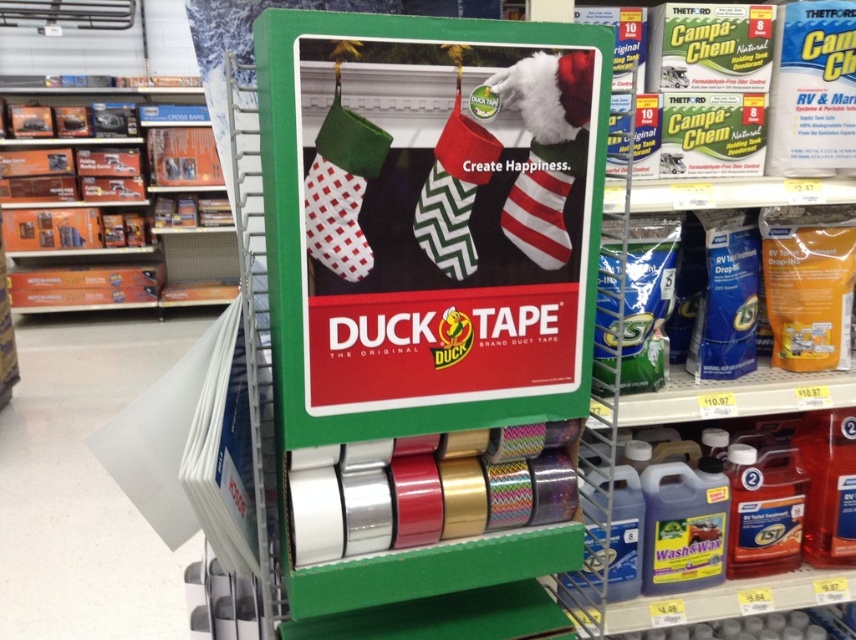
Who is positioned more to the left, translucent plastic bottle at lower right or red and white striped sock at center?

red and white striped sock at center

Which of these two, translucent plastic bottle at lower right or red and white striped sock at center, stands taller?

translucent plastic bottle at lower right

Find the location of `translucent plastic bottle at lower right`. translucent plastic bottle at lower right is located at coordinates (764, 508).

I want to click on translucent plastic bottle at lower right, so click(764, 508).

Can you confirm if translucent plastic bottle at lower right is positioned to the left of green zigzag fabric sock at center?

Incorrect, translucent plastic bottle at lower right is not on the left side of green zigzag fabric sock at center.

Measure the distance between translucent plastic bottle at lower right and green zigzag fabric sock at center.

translucent plastic bottle at lower right is 33.09 inches away from green zigzag fabric sock at center.

Locate an element on the screen. This screenshot has width=856, height=640. translucent plastic bottle at lower right is located at coordinates (764, 508).

Where is `translucent plastic bottle at lower right`? This screenshot has height=640, width=856. translucent plastic bottle at lower right is located at coordinates (764, 508).

Does white checkered fabric stocking at center have a greater height compared to red and white striped sock at center?

Indeed, white checkered fabric stocking at center has a greater height compared to red and white striped sock at center.

Is point (333, 154) positioned in front of point (544, 168)?

Yes, point (333, 154) is in front of point (544, 168).

At what (x,y) coordinates should I click in order to perform the action: click on white checkered fabric stocking at center. Please return your answer as a coordinate pair (x, y). Image resolution: width=856 pixels, height=640 pixels. Looking at the image, I should click on (342, 189).